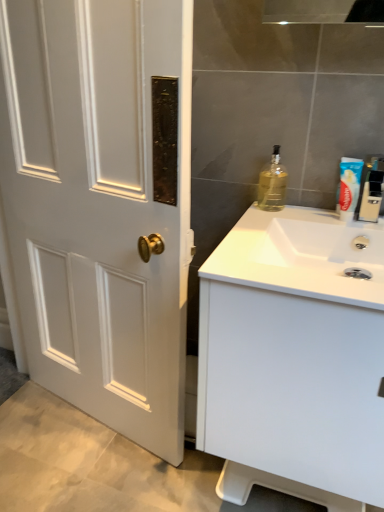
Locate an element on the screen. vacant space in between blue plastic toothpaste at upper right and translucent glass bottle at upper right, which ranks as the 1th bottle in left-to-right order is located at coordinates (305, 211).